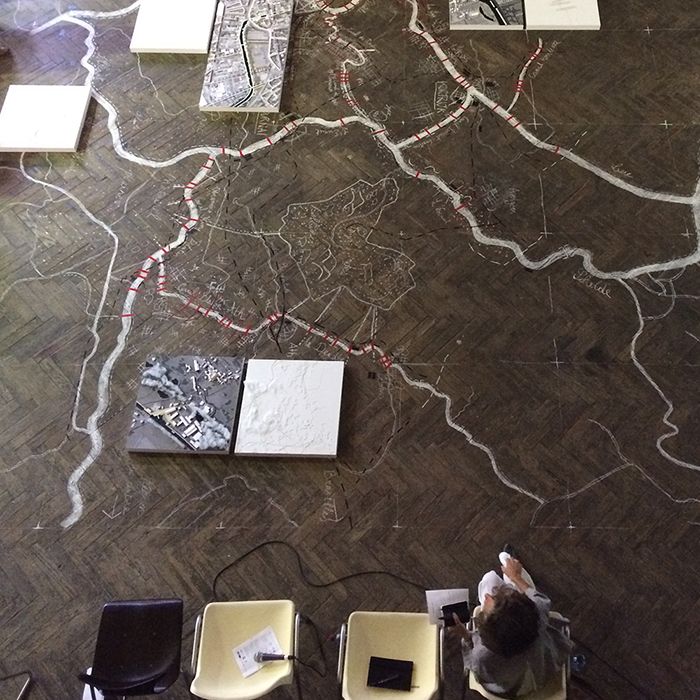
The height and width of the screenshot is (700, 700). I want to click on chair, so [x=476, y=687], [x=378, y=626], [x=255, y=610], [x=155, y=619].